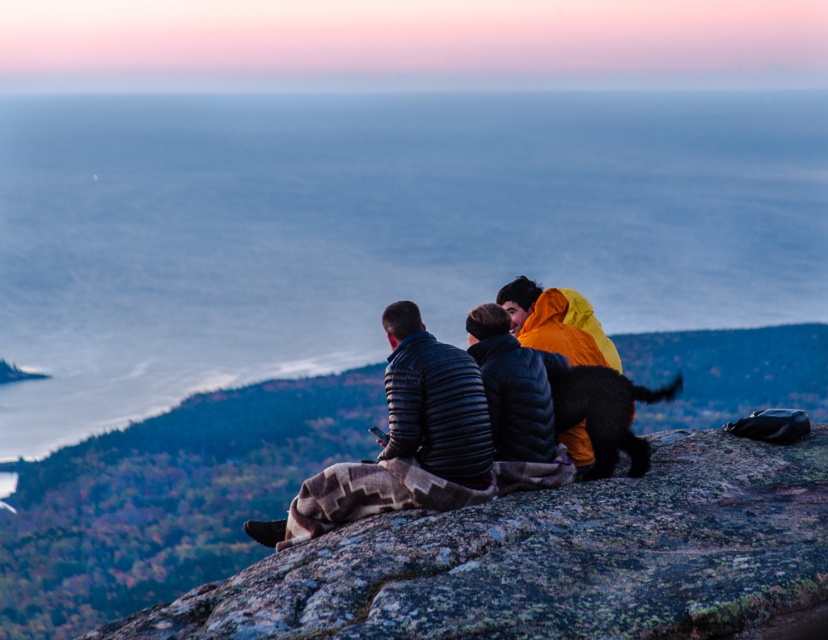
Which is more to the left, blue water at center or matte black jackets at center?

blue water at center

Which is in front, point (54, 161) or point (514, 298)?

Point (514, 298) is in front.

Identify the location of blue water at center. Image resolution: width=828 pixels, height=640 pixels. (376, 228).

Between point (777, 144) and point (626, 557), which one is positioned behind?

Positioned behind is point (777, 144).

You are a GUI agent. You are given a task and a screenshot of the screen. Output one action in this format:
    pyautogui.click(x=<x>, y=<y>)
    Task: Click on the blue water at center
    This screenshot has width=828, height=640.
    Given the screenshot: What is the action you would take?
    pyautogui.click(x=376, y=228)

This screenshot has height=640, width=828. What are the coordinates of `blue water at center` in the screenshot? It's located at (376, 228).

Does rough textured rock at center have a lesser width compared to matte black jackets at center?

Incorrect, rough textured rock at center's width is not less than matte black jackets at center's.

Can you confirm if rough textured rock at center is wider than matte black jackets at center?

Yes.

What do you see at coordinates (552, 560) in the screenshot?
I see `rough textured rock at center` at bounding box center [552, 560].

Identify the location of rough textured rock at center. Image resolution: width=828 pixels, height=640 pixels. (552, 560).